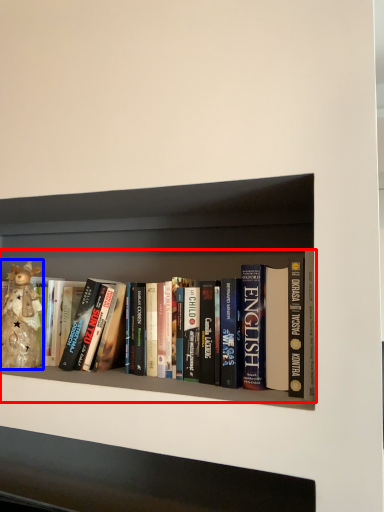
Question: Which of the following is the closest to the observer, book (highlighted by a red box) or toy (highlighted by a blue box)?

Choices:
 (A) book
 (B) toy

Answer: (A)